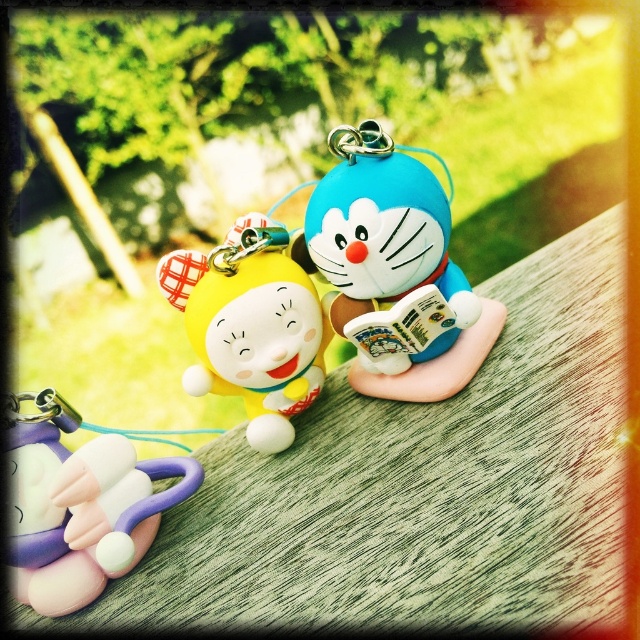
You are standing 40 inches away from a wooden surface with keychains. Can you reach the point at coordinates (x=376, y=141) without moving your position?

The point at coordinates (x=376, y=141) is 39.03 inches away from you. Since you are standing 40 inches away, you can reach it by extending your arm slightly.

You are standing in front of the wooden surface where the keychains are placed. There are two points marked on the surface at coordinates point (385, 362) and point (240, 378). From your perspective, which point is closer to you?

Point (240, 378) is closer to you because point (385, 362) is behind it.

You are organizing keychains on a shelf and need to know their sizes. Which keychain is wider, the matte plastic doraemon at center or the pink rubber toy at lower left?

The matte plastic doraemon at center is wider than the pink rubber toy at lower left according to the description.